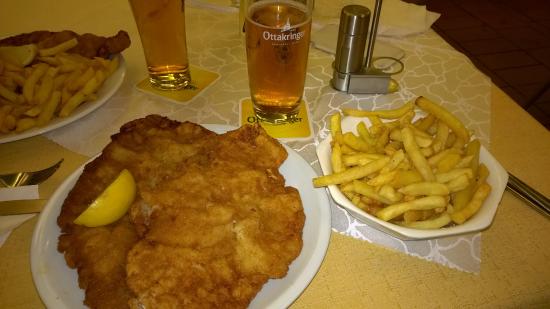
Locate an element on the screen. white plates is located at coordinates (107, 93), (314, 197).